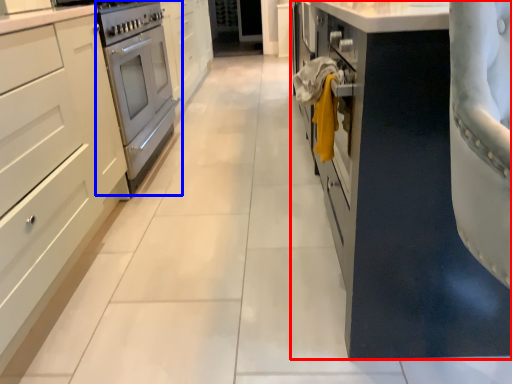
Question: Among these objects, which one is farthest to the camera, cabinetry (highlighted by a red box) or home appliance (highlighted by a blue box)?

Choices:
 (A) cabinetry
 (B) home appliance

Answer: (B)